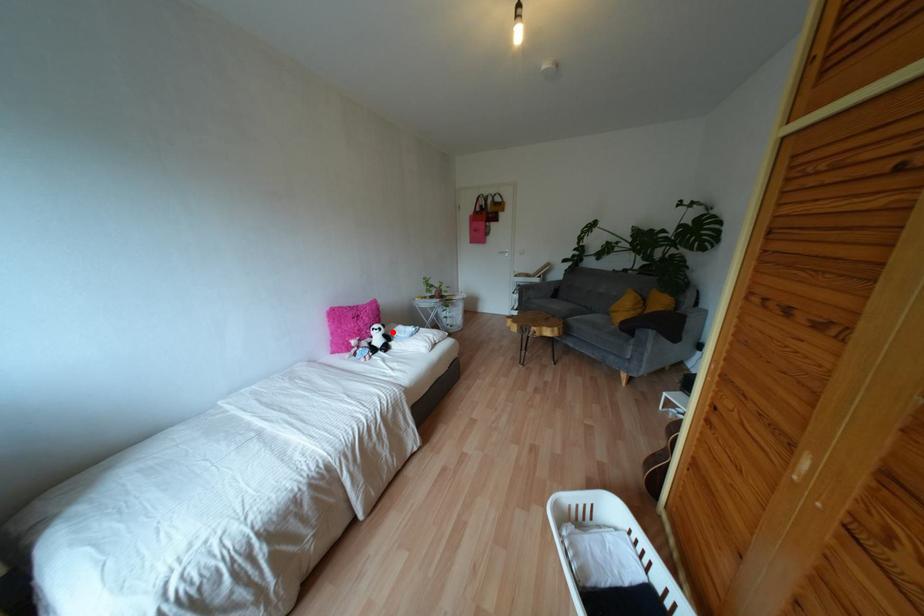
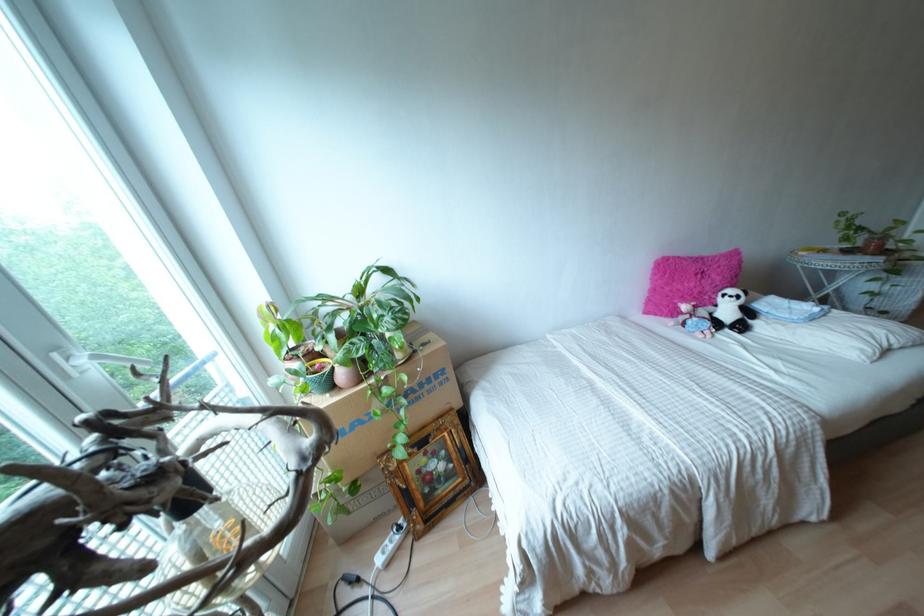
In the second image, find the point that corresponds to the highlighted location in the first image.

(759, 305)